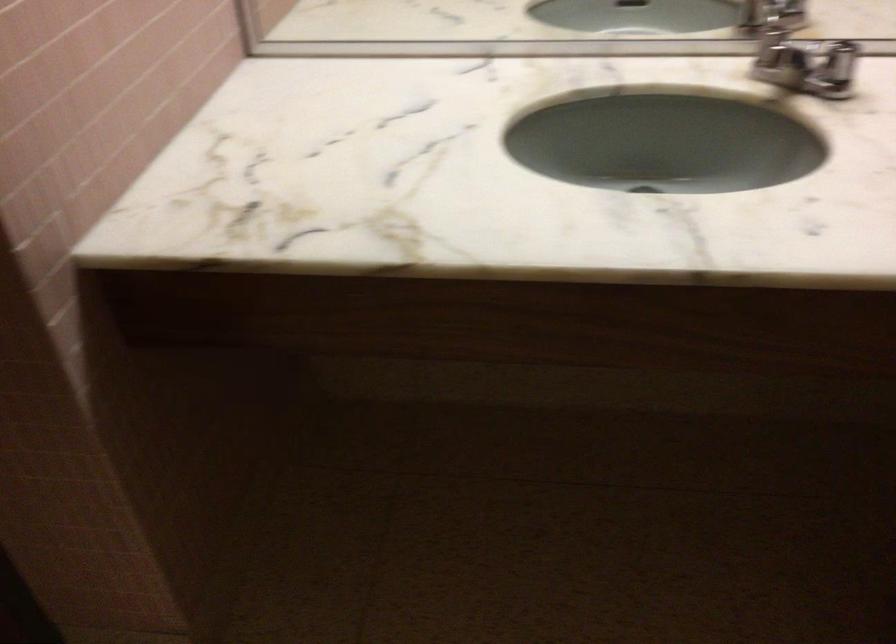
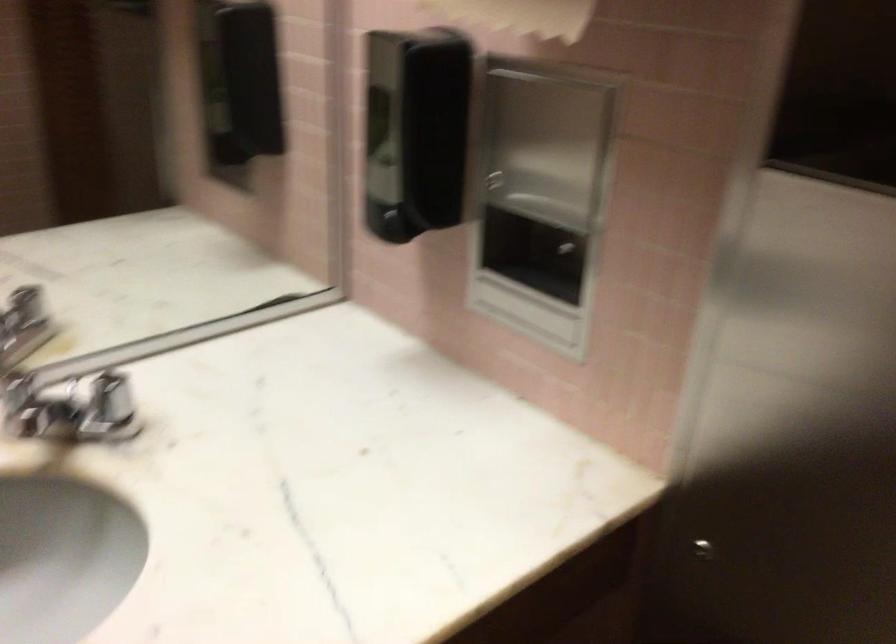
Question: The images are taken continuously from a first-person perspective. In which direction is your viewpoint rotating?

Choices:
 (A) Left
 (B) Right
 (C) Up
 (D) Down

Answer: (B)